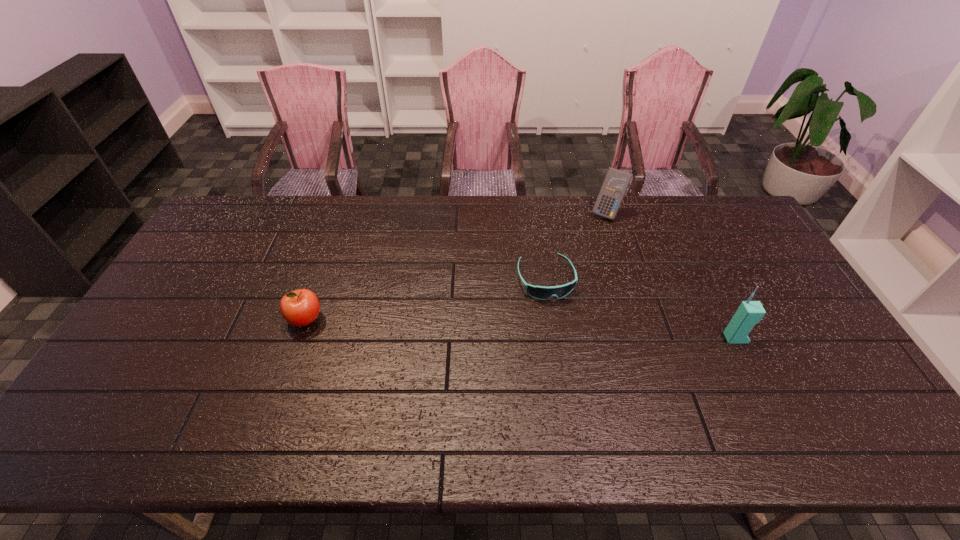
Identify the location of vacant region that satisfies the following two spatial constraints: 1. on the front side of the leftmost object; 2. on the keypad of the cellular telephone. This screenshot has width=960, height=540. (300, 338).

You are a GUI agent. You are given a task and a screenshot of the screen. Output one action in this format:
    pyautogui.click(x=<x>, y=<y>)
    Task: Click on the vacant space that satisfies the following two spatial constraints: 1. on the back side of the second object from left to right; 2. on the left side of the leftmost object
    The height and width of the screenshot is (540, 960).
    Given the screenshot: What is the action you would take?
    pyautogui.click(x=320, y=279)